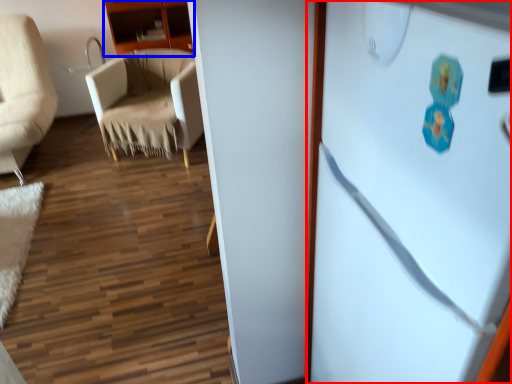
Question: Which point is closer to the camera, refrigerator (highlighted by a red box) or cabinetry (highlighted by a blue box)?

Choices:
 (A) refrigerator
 (B) cabinetry

Answer: (A)